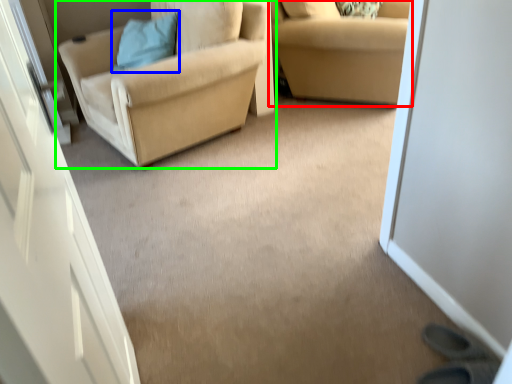
Question: Based on their relative distances, which object is farther from studio couch (highlighted by a red box)? Choose from pillow (highlighted by a blue box) and chair (highlighted by a green box).

Choices:
 (A) pillow
 (B) chair

Answer: (A)